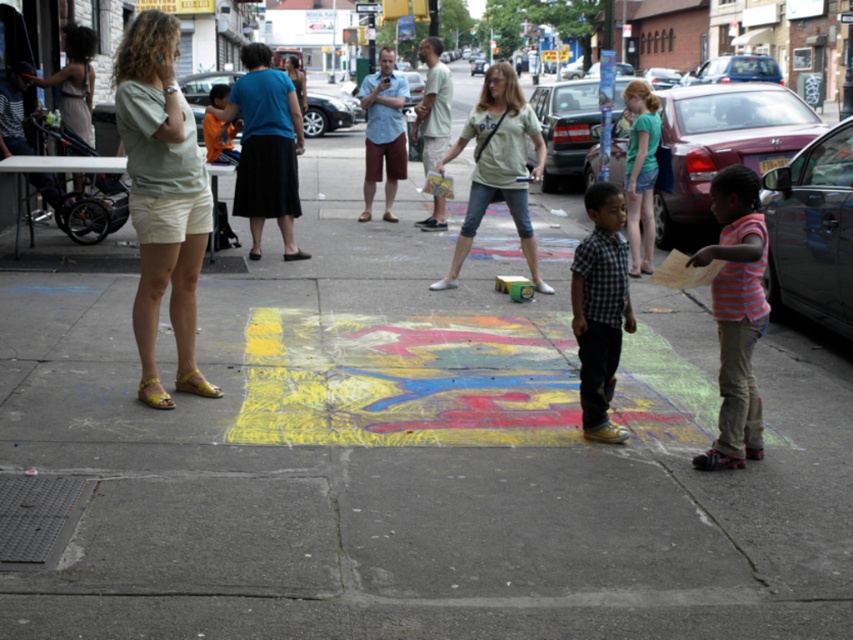
Question: Which of the following is the farthest from the observer?

Choices:
 (A) (480, 116)
 (B) (604, 323)

Answer: (A)

Question: Which of the following is the farthest from the observer?

Choices:
 (A) striped cotton shirt at lower right
 (B) light green t-shirt at center
 (C) matte blue shirt at center

Answer: (C)

Question: Which of the following is the farthest from the observer?

Choices:
 (A) (573, 269)
 (B) (206, 241)
 (C) (735, 333)
 (D) (300, 90)

Answer: (D)

Question: Is plaid cotton shirt at center thinner than matte blue shirt at center?

Choices:
 (A) no
 (B) yes

Answer: (B)

Question: Is striped cotton shirt at lower right wider than plaid cotton shirt at center?

Choices:
 (A) no
 (B) yes

Answer: (B)

Question: Does light green cotton shirt at left have a smaller size compared to light green t-shirt at center?

Choices:
 (A) no
 (B) yes

Answer: (B)